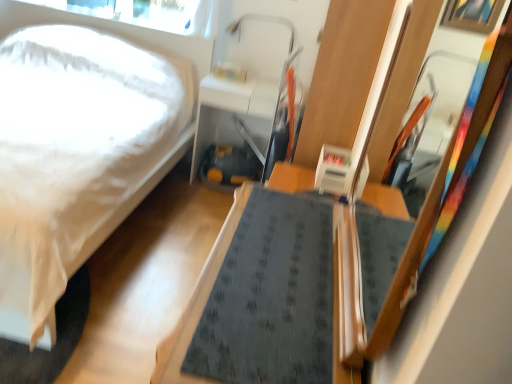
Identify the location of vacant space underneath wooden framed mirror at right (from a real-world perspective). (348, 270).